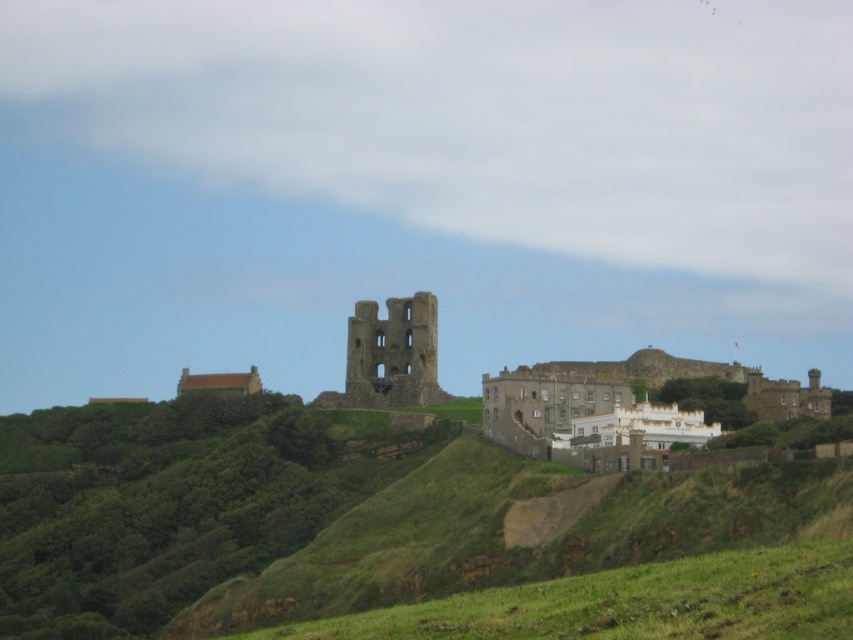
Question: Considering the real-world distances, which object is farthest from the green grassy hillside at lower center?

Choices:
 (A) green grassy hillside at center
 (B) brown stone castle at center

Answer: (B)

Question: Which of the following is the farthest from the observer?

Choices:
 (A) (848, 560)
 (B) (363, 326)
 (C) (805, 467)

Answer: (B)

Question: Which point is closer to the camera?

Choices:
 (A) green grassy hillside at center
 (B) green grassy hillside at lower center
 (C) brown stone castle at center

Answer: (B)

Question: Can you confirm if green grassy hillside at center is wider than green grassy hillside at lower center?

Choices:
 (A) no
 (B) yes

Answer: (B)

Question: Is green grassy hillside at center to the right of green grassy hillside at lower center from the viewer's perspective?

Choices:
 (A) yes
 (B) no

Answer: (B)

Question: Is green grassy hillside at center thinner than green grassy hillside at lower center?

Choices:
 (A) yes
 (B) no

Answer: (B)